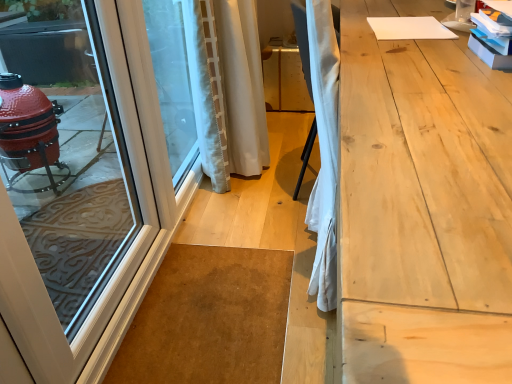
Question: Is white glossy door at left far from white textured curtain at center?

Choices:
 (A) yes
 (B) no

Answer: (B)

Question: Does white glossy door at left come behind white textured curtain at center?

Choices:
 (A) no
 (B) yes

Answer: (A)

Question: Does white glossy door at left appear on the right side of white textured curtain at center?

Choices:
 (A) yes
 (B) no

Answer: (B)

Question: Does white glossy door at left have a greater height compared to white textured curtain at center?

Choices:
 (A) no
 (B) yes

Answer: (B)

Question: Can you confirm if white glossy door at left is shorter than white textured curtain at center?

Choices:
 (A) no
 (B) yes

Answer: (A)

Question: Relative to transparent glass window screen at left, is white textured curtain at center in front or behind?

Choices:
 (A) behind
 (B) front

Answer: (A)

Question: Considering the positions of point (230, 13) and point (161, 76), is point (230, 13) closer or farther from the camera than point (161, 76)?

Choices:
 (A) closer
 (B) farther

Answer: (A)

Question: Looking at their shapes, would you say white textured curtain at center is wider or thinner than transparent glass window screen at left?

Choices:
 (A) wide
 (B) thin

Answer: (A)

Question: Is white textured curtain at center to the left or to the right of transparent glass window screen at left in the image?

Choices:
 (A) left
 (B) right

Answer: (B)

Question: From a real-world perspective, is white glossy door at left above or below transparent glass window screen at left?

Choices:
 (A) above
 (B) below

Answer: (A)

Question: Considering the relative positions of white glossy door at left and transparent glass window screen at left in the image provided, is white glossy door at left to the left or to the right of transparent glass window screen at left?

Choices:
 (A) left
 (B) right

Answer: (A)

Question: Is white glossy door at left taller or shorter than transparent glass window screen at left?

Choices:
 (A) short
 (B) tall

Answer: (B)

Question: Choose the correct answer: Is white glossy door at left inside transparent glass window screen at left or outside it?

Choices:
 (A) inside
 (B) outside

Answer: (B)

Question: From the image's perspective, relative to light wood workbench at right, is transparent glass window screen at left above or below?

Choices:
 (A) above
 (B) below

Answer: (A)

Question: Does point (170, 61) appear closer or farther from the camera than point (506, 79)?

Choices:
 (A) closer
 (B) farther

Answer: (B)